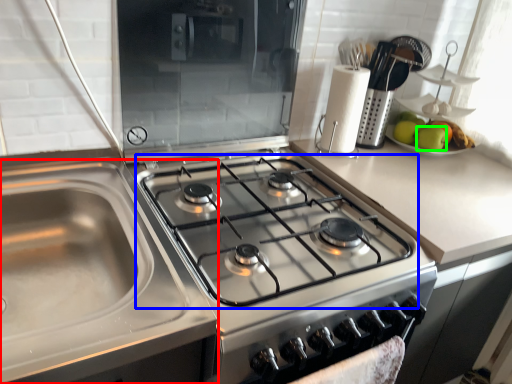
Question: Which object is the closest to the sink (highlighted by a red box)? Choose among these: gas stove (highlighted by a blue box) or apple (highlighted by a green box).

Choices:
 (A) gas stove
 (B) apple

Answer: (A)